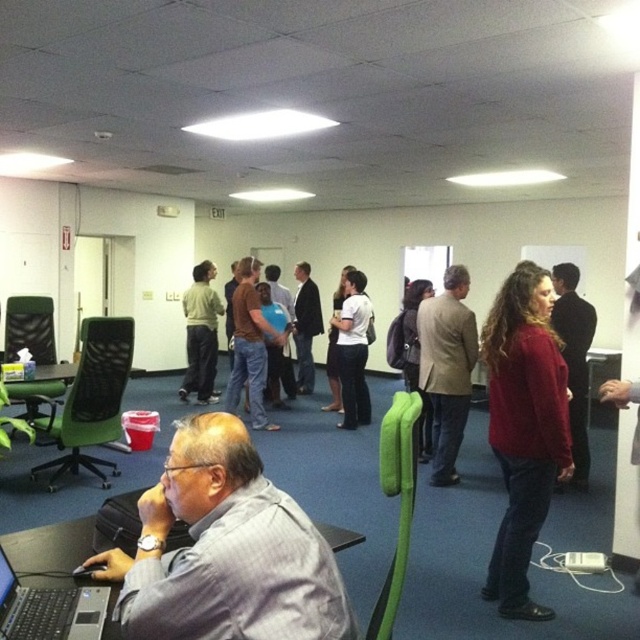
Question: Which object is the closest to the light brown textured blazer at center?

Choices:
 (A) red sweater at center
 (B) matte red sweater at center
 (C) gray striped shirt at lower left

Answer: (A)

Question: Does light brown textured blazer at center have a larger size compared to silver metallic laptop at lower left?

Choices:
 (A) yes
 (B) no

Answer: (A)

Question: Estimate the real-world distances between objects in this image. Which object is closer to the gray striped shirt at lower left?

Choices:
 (A) red sweater at center
 (B) light brown textured blazer at center

Answer: (B)

Question: Does light brown textured blazer at center appear on the right side of red sweater at center?

Choices:
 (A) yes
 (B) no

Answer: (B)

Question: Which point appears closest to the camera in this image?

Choices:
 (A) (496, 346)
 (B) (122, 358)
 (C) (92, 625)

Answer: (C)

Question: Considering the relative positions of green mesh swivel chair at left and matte green pants at center in the image provided, where is green mesh swivel chair at left located with respect to matte green pants at center?

Choices:
 (A) left
 (B) right

Answer: (A)